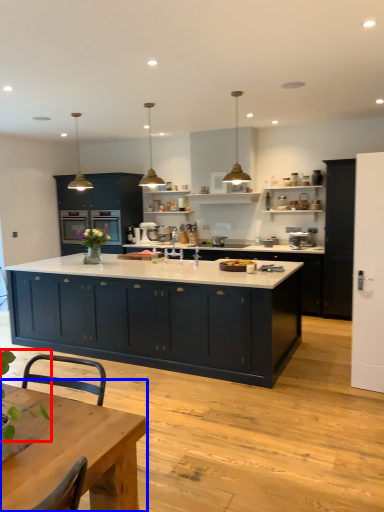
Question: Which object appears farthest to the camera in this image, plant (highlighted by a red box) or table (highlighted by a blue box)?

Choices:
 (A) plant
 (B) table

Answer: (B)